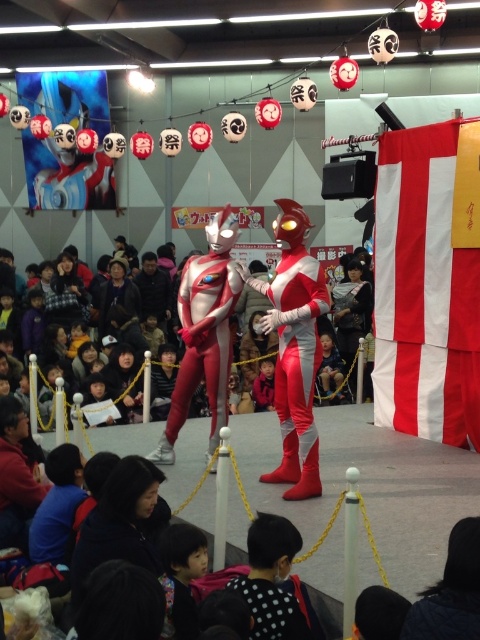
Question: Estimate the real-world distances between objects in this image. Which object is closer to the shiny metallic suit at center?

Choices:
 (A) red/white striped banner at right
 (B) silver metallic suit at center

Answer: (B)

Question: Does red/white striped banner at right come behind shiny metallic suit at center?

Choices:
 (A) no
 (B) yes

Answer: (B)

Question: Where is red/white striped banner at right located in relation to shiny metallic suit at center in the image?

Choices:
 (A) above
 (B) below

Answer: (A)

Question: Does red/white striped banner at right appear under silver metallic suit at center?

Choices:
 (A) no
 (B) yes

Answer: (A)

Question: Which of the following is the farthest from the observer?

Choices:
 (A) shiny metallic suit at center
 (B) red/white striped banner at right
 (C) silver metallic suit at center

Answer: (B)

Question: Among these points, which one is nearest to the camera?

Choices:
 (A) (312, 452)
 (B) (177, 420)
 (C) (429, 147)

Answer: (A)